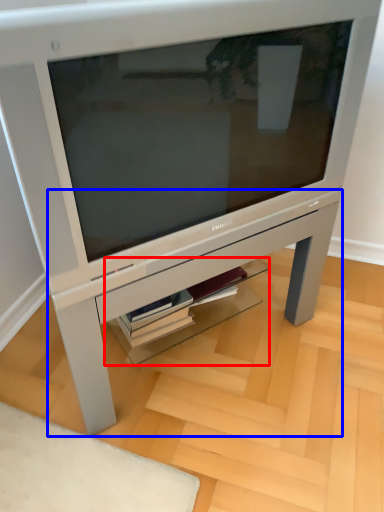
Question: Which object appears closest to the camera in this image, shelf (highlighted by a red box) or table (highlighted by a blue box)?

Choices:
 (A) shelf
 (B) table

Answer: (B)